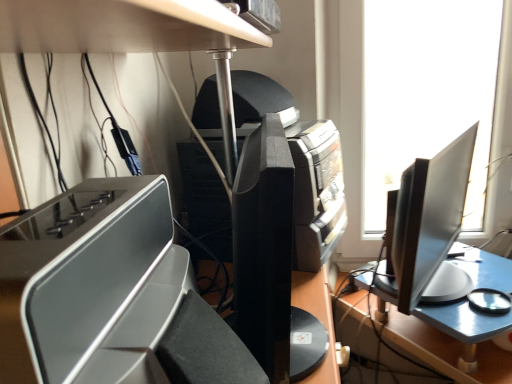
Question: Does white matte plastic tray at center have a lesser width compared to black plastic printer at center?

Choices:
 (A) yes
 (B) no

Answer: (A)

Question: Does white matte plastic tray at center have a greater height compared to black plastic printer at center?

Choices:
 (A) no
 (B) yes

Answer: (A)

Question: Can you see white matte plastic tray at center touching black plastic printer at center?

Choices:
 (A) yes
 (B) no

Answer: (B)

Question: Is white matte plastic tray at center not inside black plastic printer at center?

Choices:
 (A) yes
 (B) no

Answer: (A)

Question: Considering the relative sizes of white matte plastic tray at center and black plastic printer at center in the image provided, is white matte plastic tray at center smaller than black plastic printer at center?

Choices:
 (A) yes
 (B) no

Answer: (A)

Question: Considering the relative sizes of white matte plastic tray at center and black plastic printer at center in the image provided, is white matte plastic tray at center wider than black plastic printer at center?

Choices:
 (A) no
 (B) yes

Answer: (A)

Question: From the image's perspective, is black plastic printer at center under white matte plastic tray at center?

Choices:
 (A) no
 (B) yes

Answer: (A)

Question: Is black plastic printer at center outside of white matte plastic tray at center?

Choices:
 (A) yes
 (B) no

Answer: (A)

Question: From the image's perspective, would you say black plastic printer at center is positioned over white matte plastic tray at center?

Choices:
 (A) yes
 (B) no

Answer: (A)

Question: Does black plastic printer at center have a smaller size compared to white matte plastic tray at center?

Choices:
 (A) yes
 (B) no

Answer: (B)

Question: Is white matte plastic tray at center a part of black plastic printer at center?

Choices:
 (A) yes
 (B) no

Answer: (B)

Question: From a real-world perspective, does black plastic printer at center sit lower than white matte plastic tray at center?

Choices:
 (A) yes
 (B) no

Answer: (B)

Question: Based on their positions, is white matte plastic tray at center located to the left or right of black plastic printer at center?

Choices:
 (A) right
 (B) left

Answer: (B)